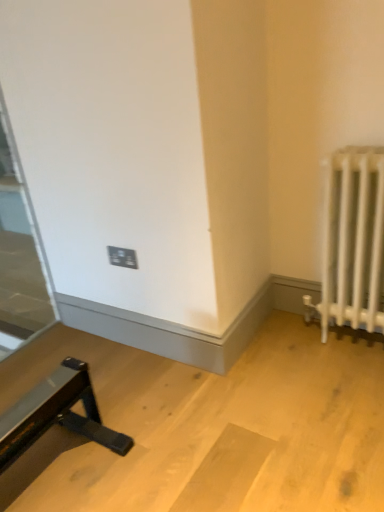
Measure the distance between point (119, 258) and camera.

Point (119, 258) is 5.82 feet away from camera.

The height and width of the screenshot is (512, 384). What do you see at coordinates (122, 257) in the screenshot?
I see `black plastic outlet at center` at bounding box center [122, 257].

The height and width of the screenshot is (512, 384). Describe the element at coordinates (352, 242) in the screenshot. I see `white metal radiator at right` at that location.

Identify the location of black plastic outlet at center. (122, 257).

From the picture: Is black plastic outlet at center far away from transparent glass door at left?

black plastic outlet at center is positioned a significant distance from transparent glass door at left.

From a real-world perspective, is black plastic outlet at center physically located above or below transparent glass door at left?

From a real-world perspective, black plastic outlet at center is physically below transparent glass door at left.

From the picture: Which is farther from the camera, (125, 262) or (44, 259)?

The point (44, 259) is behind.

Considering the points (0, 263) and (112, 251), which point is behind, point (0, 263) or point (112, 251)?

The point (0, 263) is farther.

From a real-world perspective, which object stands above the other?

transparent glass door at left is physically above.

Between transparent glass door at left and black plastic outlet at center, which one has larger width?

transparent glass door at left is wider.

In the image, there is a transparent glass door at left. Where is `electric outlet below it (from a real-world perspective)`? The image size is (384, 512). electric outlet below it (from a real-world perspective) is located at coordinates coord(122,257).

In terms of size, does white metal radiator at right appear bigger or smaller than transparent glass door at left?

Considering their sizes, white metal radiator at right takes up more space than transparent glass door at left.

Which point is more forward, (341, 212) or (29, 213)?

The point (341, 212) is in front.

From the image's perspective, is white metal radiator at right on transparent glass door at left?

No, from the image's perspective, white metal radiator at right is not over transparent glass door at left.

Between white metal radiator at right and transparent glass door at left, which one has less height?

white metal radiator at right is shorter.

Find the location of `glass door that is above the white metal radiator at right (from a real-world perspective)`. glass door that is above the white metal radiator at right (from a real-world perspective) is located at coordinates (19, 254).

Does transparent glass door at left touch white metal radiator at right?

No, transparent glass door at left is not touching white metal radiator at right.

Measure the distance between transparent glass door at left and white metal radiator at right.

transparent glass door at left and white metal radiator at right are 7.80 feet apart from each other.

Which object is positioned more to the left, transparent glass door at left or white metal radiator at right?

Positioned to the left is transparent glass door at left.

Can you confirm if white metal radiator at right is shorter than black plastic outlet at center?

No.

Can you confirm if white metal radiator at right is bigger than black plastic outlet at center?

Correct, white metal radiator at right is larger in size than black plastic outlet at center.

From the picture: Is white metal radiator at right not close to black plastic outlet at center?

Actually, white metal radiator at right and black plastic outlet at center are a little close together.

Is white metal radiator at right looking in the opposite direction of black plastic outlet at center?

white metal radiator at right is not turned away from black plastic outlet at center.

Which object is wider, black plastic outlet at center or white metal radiator at right?

With larger width is white metal radiator at right.

Considering the positions of objects black plastic outlet at center and white metal radiator at right in the image provided, who is behind, black plastic outlet at center or white metal radiator at right?

black plastic outlet at center.

Is point (129, 257) positioned in front of point (328, 188)?

No, it is behind (328, 188).

Can you see black plastic outlet at center touching white metal radiator at right?

black plastic outlet at center is not next to white metal radiator at right, and they're not touching.

Identify the location of glass door in front of the black plastic outlet at center. The height and width of the screenshot is (512, 384). [x=19, y=254].

Where is `electric outlet that is below the transparent glass door at left (from the image's perspective)`? Image resolution: width=384 pixels, height=512 pixels. electric outlet that is below the transparent glass door at left (from the image's perspective) is located at coordinates (122, 257).

Looking at the image, which one is located further to transparent glass door at left, white metal radiator at right or black plastic outlet at center?

white metal radiator at right.

From the image, which object appears to be nearer to black plastic outlet at center, transparent glass door at left or white metal radiator at right?

white metal radiator at right.

Estimate the real-world distances between objects in this image. Which object is closer to transparent glass door at left, black plastic outlet at center or white metal radiator at right?

Among the two, black plastic outlet at center is located nearer to transparent glass door at left.

Looking at the image, which one is located closer to white metal radiator at right, black plastic outlet at center or transparent glass door at left?

black plastic outlet at center is positioned closer to the anchor white metal radiator at right.

Considering their positions, is transparent glass door at left positioned closer to white metal radiator at right than black plastic outlet at center?

black plastic outlet at center is positioned closer to the anchor white metal radiator at right.

Which object lies nearer to the anchor point black plastic outlet at center, white metal radiator at right or transparent glass door at left?

white metal radiator at right is positioned closer to the anchor black plastic outlet at center.

Find the location of a particular element. The height and width of the screenshot is (512, 384). electric outlet between transparent glass door at left and white metal radiator at right is located at coordinates (122, 257).